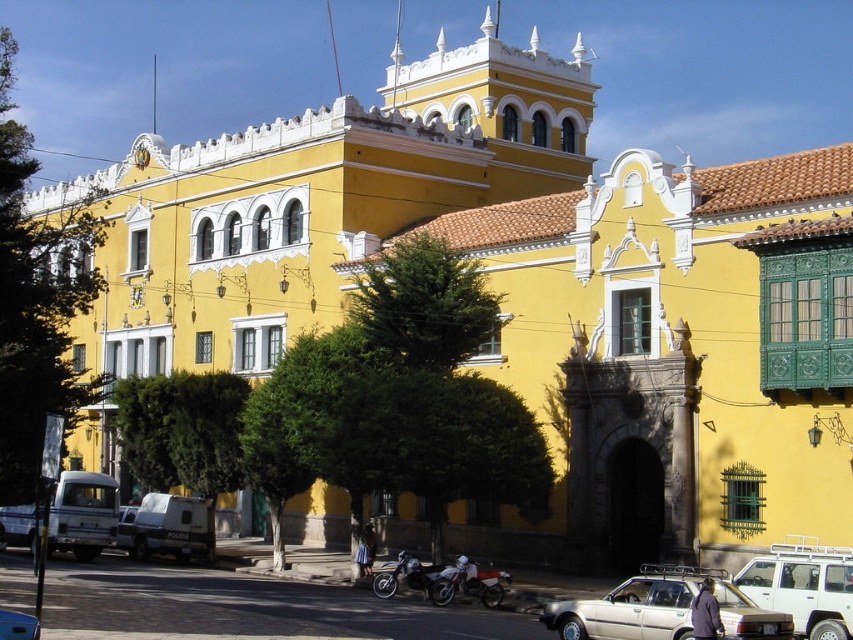
Is white matte motorcycle at center to the right of metallic silver car at lower left from the viewer's perspective?

Indeed, white matte motorcycle at center is positioned on the right side of metallic silver car at lower left.

Is white matte motorcycle at center above metallic silver car at lower left?

Actually, white matte motorcycle at center is below metallic silver car at lower left.

Image resolution: width=853 pixels, height=640 pixels. Describe the element at coordinates (469, 582) in the screenshot. I see `white matte motorcycle at center` at that location.

At what (x,y) coordinates should I click in order to perform the action: click on white matte motorcycle at center. Please return your answer as a coordinate pair (x, y). This screenshot has width=853, height=640. Looking at the image, I should click on (469, 582).

Is point (663, 577) less distant than point (1, 625)?

No, it is behind (1, 625).

How much distance is there between white matte sedan at lower center and metallic silver car at lower left?

The distance of white matte sedan at lower center from metallic silver car at lower left is 59.84 feet.

Who is more distant from viewer, [566,625] or [10,621]?

The point [566,625] is more distant.

Where is `white matte sedan at lower center`? This screenshot has height=640, width=853. white matte sedan at lower center is located at coordinates (662, 609).

Who is more forward, [851,598] or [392,586]?

Point [851,598] is more forward.

Based on the photo, does white matte suv at center have a lesser width compared to shiny chrome motorcycle at lower center?

Incorrect, white matte suv at center's width is not less than shiny chrome motorcycle at lower center's.

I want to click on white matte suv at center, so click(804, 586).